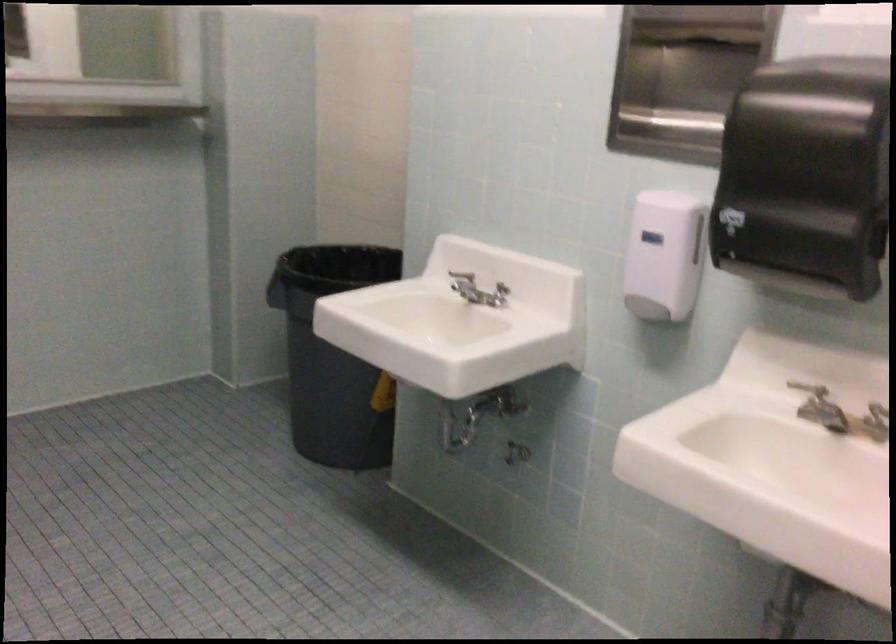
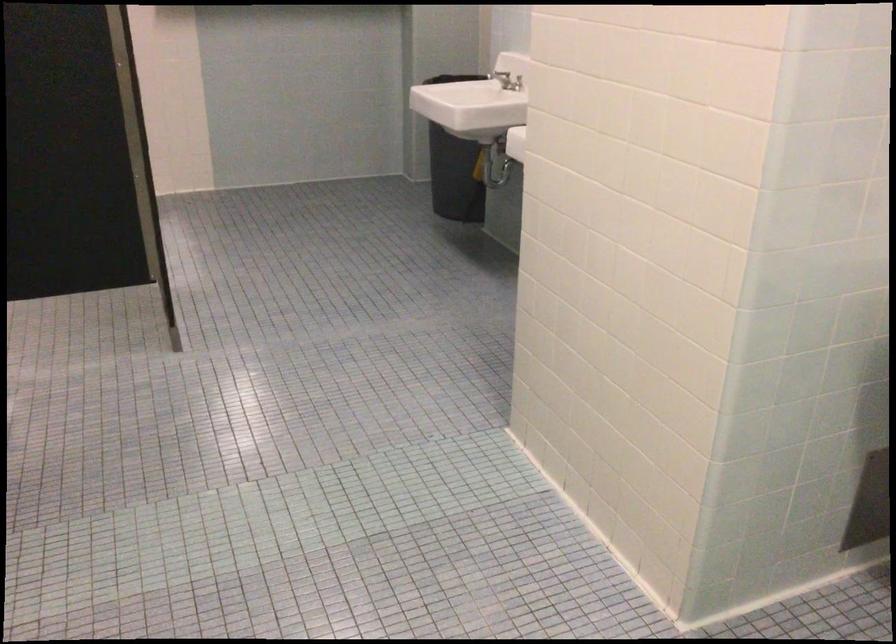
Question: I am providing you with two images of the same scene from different viewpoints. After the viewpoint changes to image2, which objects are now occluded?

Choices:
 (A) soap dispenser pump
 (B) blue stuffed toy
 (C) metal faucet handle
 (D) dark trash can

Answer: (A)